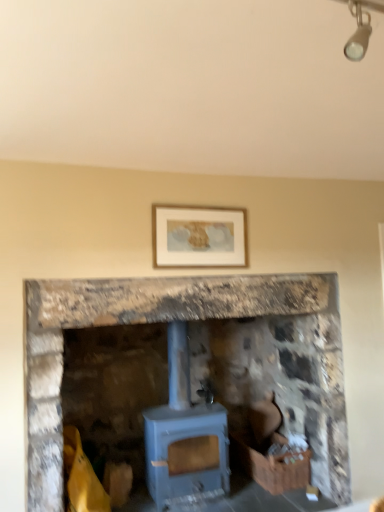
I want to click on blue matte wood burning stove at center, so click(185, 436).

What is the approximate width of wooden crate at lower right?

It is 17.16 inches.

Where is `brown leather chair at lower right`? The height and width of the screenshot is (512, 384). brown leather chair at lower right is located at coordinates (264, 418).

Would you consider blue stone fireplace at center to be distant from brown leather chair at lower right?

No, there isn't a large distance between blue stone fireplace at center and brown leather chair at lower right.

From the image's perspective, which object appears higher, blue stone fireplace at center or brown leather chair at lower right?

blue stone fireplace at center appears higher in the image.

Between point (330, 424) and point (252, 414), which one is positioned behind?

The point (252, 414) is behind.

Is blue stone fireplace at center thinner than brown leather chair at lower right?

No, blue stone fireplace at center is not thinner than brown leather chair at lower right.

Would you say brown leather chair at lower right is part of wooden crate at lower right's contents?

No, brown leather chair at lower right is located outside of wooden crate at lower right.

Between wooden crate at lower right and brown leather chair at lower right, which one is positioned behind?

brown leather chair at lower right.

The height and width of the screenshot is (512, 384). Identify the location of chair behind the wooden crate at lower right. (264, 418).

Which of these two, wooden crate at lower right or brown leather chair at lower right, is wider?

With larger width is wooden crate at lower right.

From the image's perspective, which one is positioned higher, blue stone fireplace at center or matte white picture frame at upper center?

matte white picture frame at upper center appears higher in the image.

Considering the relative sizes of blue stone fireplace at center and matte white picture frame at upper center in the image provided, is blue stone fireplace at center wider than matte white picture frame at upper center?

Correct, the width of blue stone fireplace at center exceeds that of matte white picture frame at upper center.

Is blue stone fireplace at center looking in the opposite direction of matte white picture frame at upper center?

blue stone fireplace at center is not turned away from matte white picture frame at upper center.

Would you say matte white picture frame at upper center is part of blue stone fireplace at center's contents?

No, matte white picture frame at upper center is not inside blue stone fireplace at center.

Considering the relative sizes of brown leather chair at lower right and wooden crate at lower right in the image provided, is brown leather chair at lower right smaller than wooden crate at lower right?

Yes, brown leather chair at lower right is smaller than wooden crate at lower right.

From a real-world perspective, is brown leather chair at lower right positioned over wooden crate at lower right based on gravity?

Indeed, from a real-world perspective, brown leather chair at lower right stands above wooden crate at lower right.

Considering the relative positions of brown leather chair at lower right and wooden crate at lower right in the image provided, is brown leather chair at lower right to the right of wooden crate at lower right from the viewer's perspective?

Correct, you'll find brown leather chair at lower right to the right of wooden crate at lower right.

This screenshot has width=384, height=512. Identify the location of fireplace above the wooden crate at lower right (from a real-world perspective). point(190,364).

Does point (347, 435) appear closer or farther from the camera than point (241, 452)?

Clearly, point (347, 435) is closer to the camera than point (241, 452).

From a real-world perspective, is blue stone fireplace at center above or below wooden crate at lower right?

Clearly, from a real-world perspective, blue stone fireplace at center is above wooden crate at lower right.

From the image's perspective, is blue stone fireplace at center positioned above or below wooden crate at lower right?

From the image's perspective, blue stone fireplace at center appears above wooden crate at lower right.

Is point (168, 259) positioned in front of point (295, 469)?

Yes, it is.

Who is more distant, matte white picture frame at upper center or wooden crate at lower right?

Positioned behind is wooden crate at lower right.

Between matte white picture frame at upper center and wooden crate at lower right, which one has smaller width?

matte white picture frame at upper center.

What's the angular difference between blue matte wood burning stove at center and brown leather chair at lower right's facing directions?

The angular difference between blue matte wood burning stove at center and brown leather chair at lower right is 3.26 degrees.

Does blue matte wood burning stove at center have a larger size compared to brown leather chair at lower right?

Yes, blue matte wood burning stove at center is bigger than brown leather chair at lower right.

Looking at their sizes, would you say blue matte wood burning stove at center is wider or thinner than brown leather chair at lower right?

blue matte wood burning stove at center is wider than brown leather chair at lower right.

Is blue matte wood burning stove at center completely or partially outside of brown leather chair at lower right?

Yes, blue matte wood burning stove at center is located beyond the bounds of brown leather chair at lower right.

Identify the location of fireplace above the brown leather chair at lower right (from a real-world perspective). pos(190,364).

Locate an element on the screen. crate on the left of brown leather chair at lower right is located at coordinates (271, 464).

Looking at the image, which one is located closer to wooden crate at lower right, blue matte wood burning stove at center or brown leather chair at lower right?

brown leather chair at lower right is closer to wooden crate at lower right.

Which object lies nearer to the anchor point blue matte wood burning stove at center, brown leather chair at lower right or wooden crate at lower right?

Among the two, wooden crate at lower right is located nearer to blue matte wood burning stove at center.

From the image, which object appears to be nearer to matte white picture frame at upper center, wooden crate at lower right or blue stone fireplace at center?

blue stone fireplace at center lies closer to matte white picture frame at upper center than the other object.

Based on the photo, which object lies further to the anchor point brown leather chair at lower right, blue matte wood burning stove at center or matte white picture frame at upper center?

matte white picture frame at upper center is positioned further to the anchor brown leather chair at lower right.

Based on their spatial positions, is matte white picture frame at upper center or wooden crate at lower right closer to blue stone fireplace at center?

The object closer to blue stone fireplace at center is matte white picture frame at upper center.

When comparing their distances from wooden crate at lower right, does blue matte wood burning stove at center or blue stone fireplace at center seem further?

blue stone fireplace at center lies further to wooden crate at lower right than the other object.

When comparing their distances from wooden crate at lower right, does blue matte wood burning stove at center or matte white picture frame at upper center seem further?

The object further to wooden crate at lower right is matte white picture frame at upper center.

Based on the photo, considering their positions, is blue stone fireplace at center positioned further to blue matte wood burning stove at center than matte white picture frame at upper center?

Based on the image, matte white picture frame at upper center appears to be further to blue matte wood burning stove at center.

The width and height of the screenshot is (384, 512). What are the coordinates of `fireplace that lies between matte white picture frame at upper center and blue matte wood burning stove at center from top to bottom` in the screenshot? It's located at (190, 364).

Where is `wood burning stove between blue stone fireplace at center and wooden crate at lower right`? wood burning stove between blue stone fireplace at center and wooden crate at lower right is located at coordinates point(185,436).

Image resolution: width=384 pixels, height=512 pixels. Identify the location of wood burning stove between matte white picture frame at upper center and wooden crate at lower right vertically. (185, 436).

Where is `wood burning stove between matte white picture frame at upper center and brown leather chair at lower right in the up-down direction`? This screenshot has height=512, width=384. wood burning stove between matte white picture frame at upper center and brown leather chair at lower right in the up-down direction is located at coordinates (185, 436).